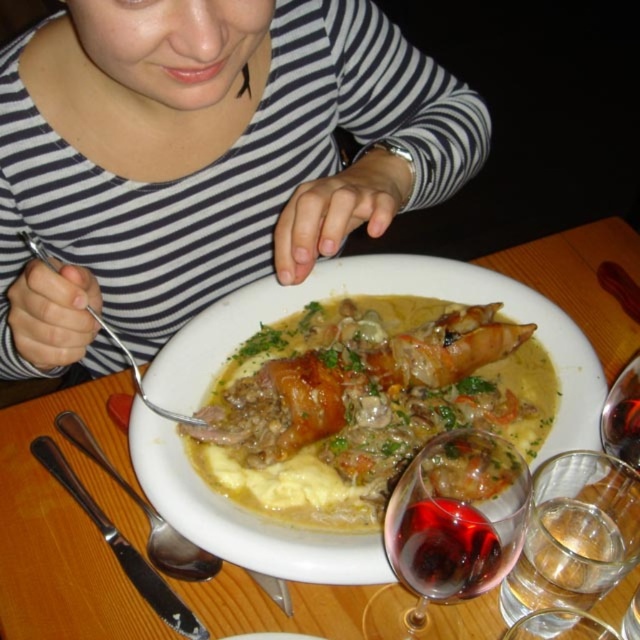
Question: Which object is positioned closest to the transparent glass at lower center?

Choices:
 (A) white ceramic plate at center
 (B) silver metallic fork at upper left
 (C) transparent glass at lower right
 (D) matte creamy stew at center

Answer: (C)

Question: Among these points, which one is farthest from the camera?

Choices:
 (A) 104,230
 (B) 490,579

Answer: (A)

Question: Among these objects, which one is farthest from the camera?

Choices:
 (A) striped fabric shirt at upper center
 (B) red glass at lower center

Answer: (A)

Question: Is transparent glass at lower center smaller than transparent glass at lower right?

Choices:
 (A) yes
 (B) no

Answer: (B)

Question: Is silver spoon at center thinner than silver metallic fork at upper left?

Choices:
 (A) yes
 (B) no

Answer: (B)

Question: Observing the image, what is the correct spatial positioning of transparent glass at lower center in reference to red glass at lower center?

Choices:
 (A) right
 (B) left

Answer: (A)